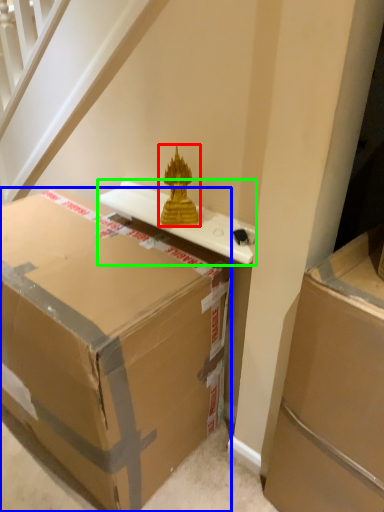
Question: Which object is the closest to the sculpture (highlighted by a red box)? Choose among these: box (highlighted by a blue box) or table (highlighted by a green box).

Choices:
 (A) box
 (B) table

Answer: (B)